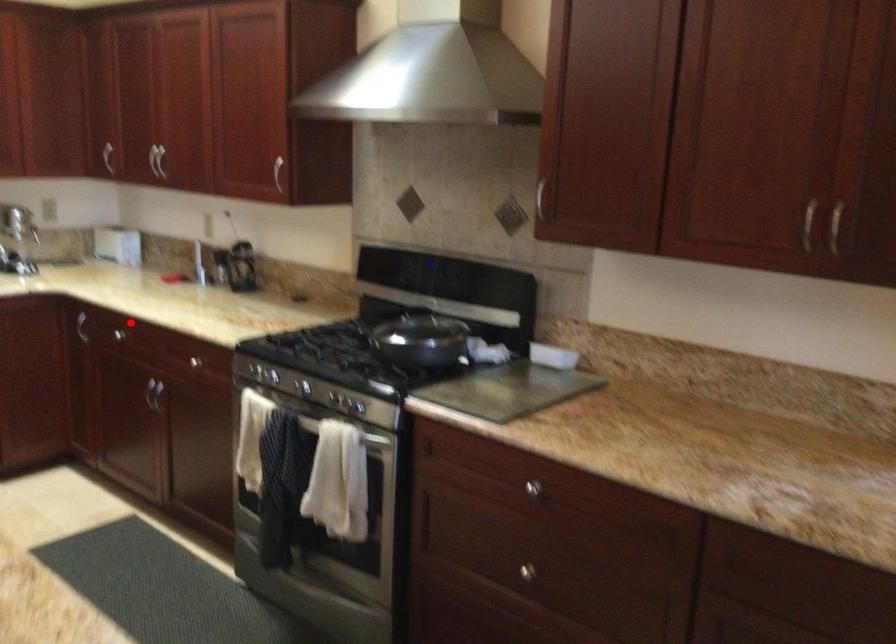
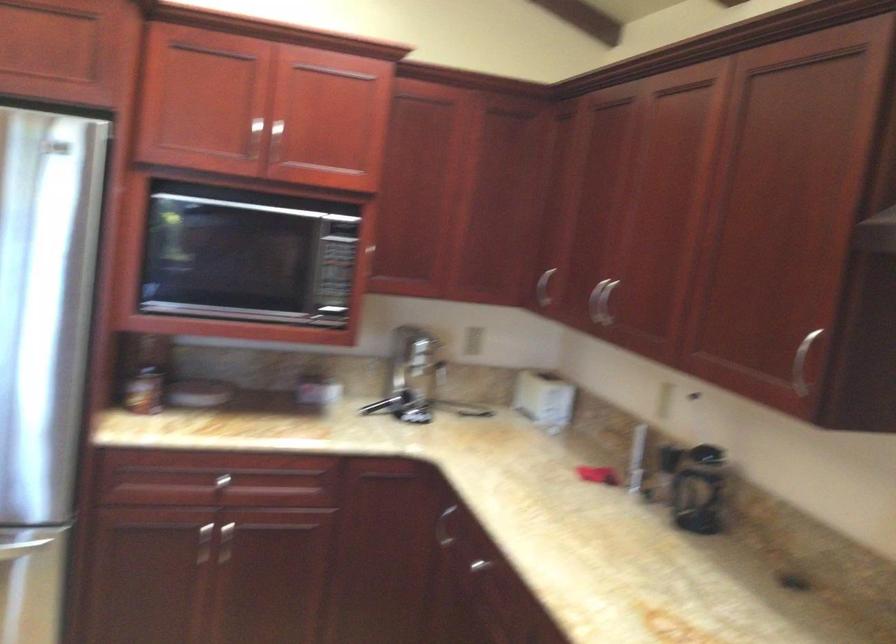
Question: I am providing you with two images of the same scene from different viewpoints. Image1 has a red point marked. In image2, the corresponding 3D location appears at what relative position? Reply with the corresponding letter.

Choices:
 (A) Closer
 (B) Farther

Answer: (A)